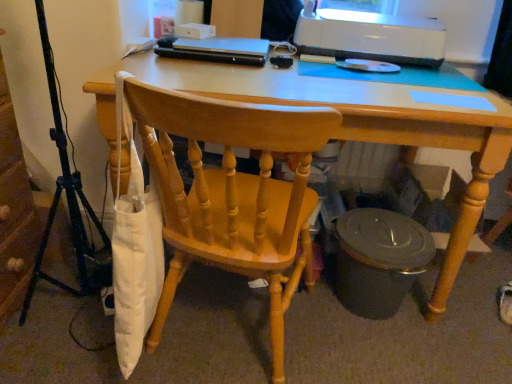
Find the location of a particular element. This screenshot has height=384, width=512. empty space that is ontop of light wood desk at center is located at coordinates (312, 71).